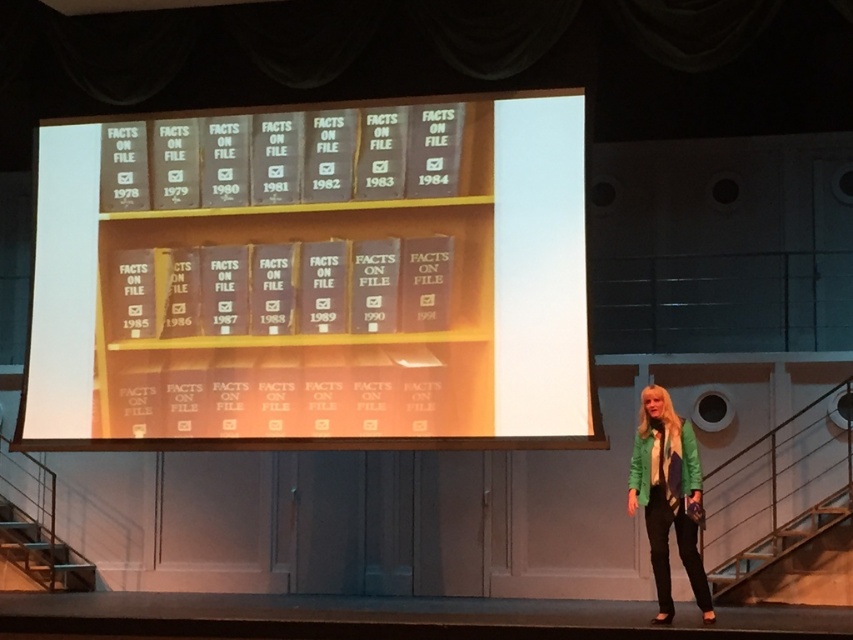
Question: Which point is closer to the camera?

Choices:
 (A) (683, 452)
 (B) (544, 269)
 (C) (688, 484)

Answer: (C)

Question: Considering the relative positions of matte gray bookshelf at center and green leather jacket at lower right in the image provided, where is matte gray bookshelf at center located with respect to green leather jacket at lower right?

Choices:
 (A) above
 (B) below

Answer: (A)

Question: Where is matte gray bookshelf at center located in relation to green leather jacket at lower right in the image?

Choices:
 (A) right
 (B) left

Answer: (B)

Question: Can you confirm if matte gray bookshelf at center is thinner than green matte jacket at lower right?

Choices:
 (A) no
 (B) yes

Answer: (A)

Question: Which object is closer to the camera taking this photo?

Choices:
 (A) green leather jacket at lower right
 (B) green matte jacket at lower right
 (C) matte gray bookshelf at center

Answer: (A)

Question: Which object is the farthest from the green leather jacket at lower right?

Choices:
 (A) green matte jacket at lower right
 (B) matte gray bookshelf at center

Answer: (B)